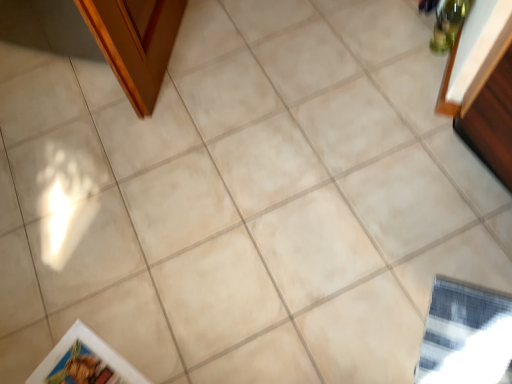
Where is `free space to the back side of green glass bottle at upper right`? free space to the back side of green glass bottle at upper right is located at coordinates 416,20.